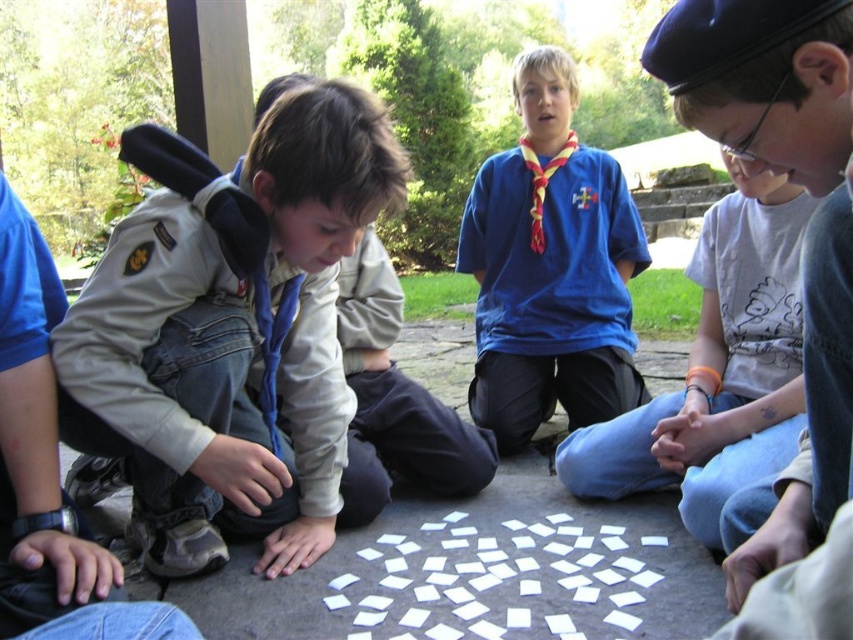
Question: Which object appears closest to the camera in this image?

Choices:
 (A) khaki uniform at center
 (B) blue cotton shirt at center
 (C) white paper at center

Answer: (C)

Question: Is blue cotton shirt at center above white paper at center?

Choices:
 (A) no
 (B) yes

Answer: (B)

Question: Among these objects, which one is farthest from the camera?

Choices:
 (A) khaki uniform at center
 (B) blue cotton shirt at center
 (C) white paper squares at center
 (D) white paper at center

Answer: (B)

Question: Can you confirm if khaki uniform at center is thinner than blue cotton shirt at center?

Choices:
 (A) no
 (B) yes

Answer: (A)

Question: Is white paper at center below white paper squares at center?

Choices:
 (A) yes
 (B) no

Answer: (B)

Question: Which object is positioned farthest from the white paper squares at center?

Choices:
 (A) khaki uniform at center
 (B) white paper at center
 (C) blue cotton shirt at center

Answer: (C)